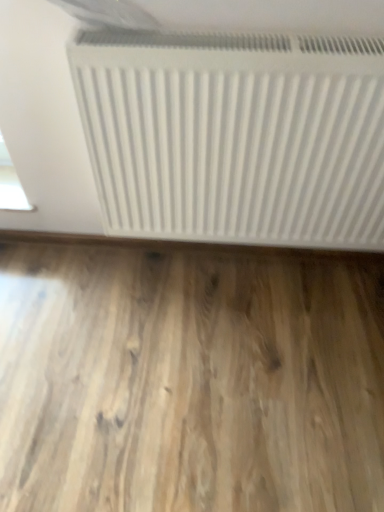
This screenshot has width=384, height=512. What do you see at coordinates (189, 377) in the screenshot?
I see `light brown wood flooring at bottom` at bounding box center [189, 377].

Image resolution: width=384 pixels, height=512 pixels. I want to click on light brown wood flooring at bottom, so click(x=189, y=377).

Find the location of a particular element. The height and width of the screenshot is (512, 384). white matte radiator at upper center is located at coordinates (235, 136).

The width and height of the screenshot is (384, 512). Describe the element at coordinates (235, 136) in the screenshot. I see `white matte radiator at upper center` at that location.

Locate an element on the screen. This screenshot has width=384, height=512. light brown wood flooring at bottom is located at coordinates coord(189,377).

Which is more to the left, light brown wood flooring at bottom or white matte radiator at upper center?

light brown wood flooring at bottom is more to the left.

In the scene shown: Between light brown wood flooring at bottom and white matte radiator at upper center, which one is positioned in front?

white matte radiator at upper center.

Which is less distant, (157, 468) or (101, 159)?

Clearly, point (157, 468) is closer to the camera than point (101, 159).

From the image's perspective, is light brown wood flooring at bottom below white matte radiator at upper center?

Yes, from the image's perspective, light brown wood flooring at bottom is below white matte radiator at upper center.

From a real-world perspective, which is physically above, light brown wood flooring at bottom or white matte radiator at upper center?

white matte radiator at upper center, from a real-world perspective.

Does light brown wood flooring at bottom have a greater width compared to white matte radiator at upper center?

Yes.

Can you confirm if light brown wood flooring at bottom is shorter than white matte radiator at upper center?

Yes, light brown wood flooring at bottom is shorter than white matte radiator at upper center.

Looking at this image, looking at the image, does light brown wood flooring at bottom seem bigger or smaller compared to white matte radiator at upper center?

Clearly, light brown wood flooring at bottom is smaller in size than white matte radiator at upper center.

Can white matte radiator at upper center be found inside light brown wood flooring at bottom?

That's incorrect, white matte radiator at upper center is not inside light brown wood flooring at bottom.

Does light brown wood flooring at bottom touch white matte radiator at upper center?

They are not placed beside each other.

Is light brown wood flooring at bottom oriented away from white matte radiator at upper center?

No, light brown wood flooring at bottom is not facing away from white matte radiator at upper center.

How far apart are light brown wood flooring at bottom and white matte radiator at upper center?

A distance of 19.73 inches exists between light brown wood flooring at bottom and white matte radiator at upper center.

The width and height of the screenshot is (384, 512). I want to click on radiator on the right of light brown wood flooring at bottom, so click(x=235, y=136).

Can you confirm if white matte radiator at upper center is positioned to the right of light brown wood flooring at bottom?

Indeed, white matte radiator at upper center is positioned on the right side of light brown wood flooring at bottom.

Which object is more forward, white matte radiator at upper center or light brown wood flooring at bottom?

white matte radiator at upper center is in front.

Considering the positions of point (218, 208) and point (51, 468), is point (218, 208) closer or farther from the camera than point (51, 468)?

Point (218, 208).

Based on the photo, from the image's perspective, between white matte radiator at upper center and light brown wood flooring at bottom, which one is located above?

white matte radiator at upper center is shown above in the image.

From a real-world perspective, between white matte radiator at upper center and light brown wood flooring at bottom, who is vertically higher?

white matte radiator at upper center, from a real-world perspective.

Which of these two, white matte radiator at upper center or light brown wood flooring at bottom, is thinner?

white matte radiator at upper center.

In the scene shown: Who is taller, white matte radiator at upper center or light brown wood flooring at bottom?

white matte radiator at upper center is taller.

Considering the sizes of white matte radiator at upper center and light brown wood flooring at bottom in the image, is white matte radiator at upper center bigger or smaller than light brown wood flooring at bottom?

Considering their sizes, white matte radiator at upper center takes up more space than light brown wood flooring at bottom.

Which is correct: white matte radiator at upper center is inside light brown wood flooring at bottom, or outside of it?

The correct answer is: outside.

Is white matte radiator at upper center not close to light brown wood flooring at bottom?

Actually, white matte radiator at upper center and light brown wood flooring at bottom are a little close together.

Is white matte radiator at upper center oriented towards light brown wood flooring at bottom?

No, white matte radiator at upper center does not turn towards light brown wood flooring at bottom.

Can you tell me how much white matte radiator at upper center and light brown wood flooring at bottom differ in facing direction?

They differ by 90.4 degrees in their facing directions.

Identify the location of hardwood below the white matte radiator at upper center (from the image's perspective). The image size is (384, 512). (189, 377).

This screenshot has height=512, width=384. There is a light brown wood flooring at bottom. What are the coordinates of `radiator above it (from a real-world perspective)` in the screenshot? It's located at (235, 136).

The width and height of the screenshot is (384, 512). I want to click on hardwood located behind the white matte radiator at upper center, so click(189, 377).